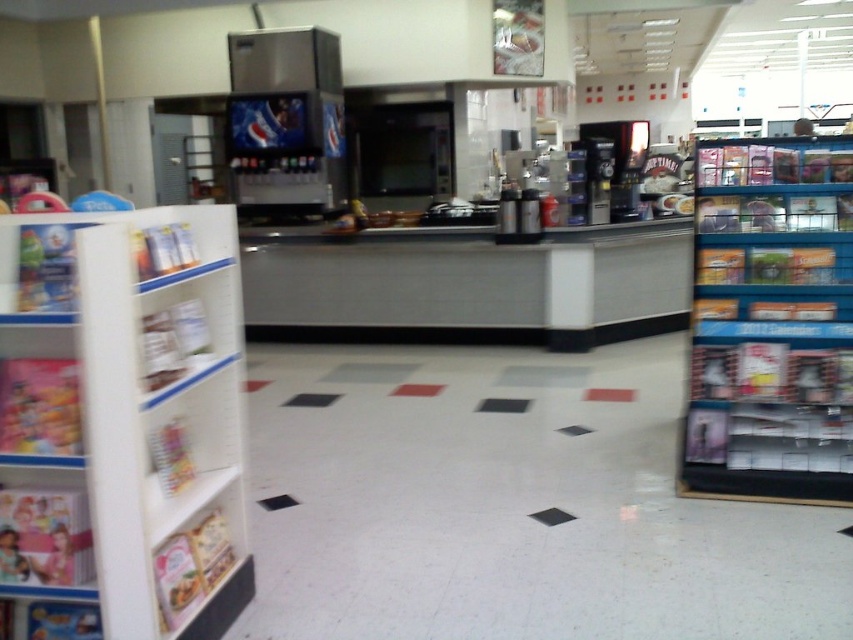
Question: Can you confirm if white cardboard shelf at left is wider than blue plastic shelves at right?

Choices:
 (A) yes
 (B) no

Answer: (B)

Question: Can you confirm if white cardboard shelf at left is positioned below blue plastic shelves at right?

Choices:
 (A) yes
 (B) no

Answer: (A)

Question: Which object appears farthest from the camera in this image?

Choices:
 (A) white cardboard shelf at left
 (B) blue plastic shelves at right

Answer: (B)

Question: Is white cardboard shelf at left positioned at the back of blue plastic shelves at right?

Choices:
 (A) yes
 (B) no

Answer: (B)